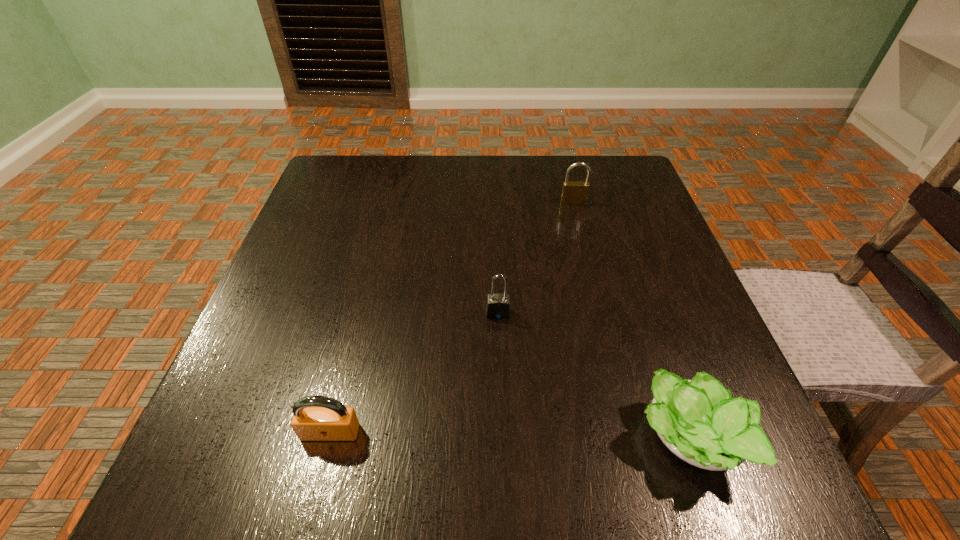
Locate an element on the screen. vacant space at the near edge is located at coordinates (545, 467).

The height and width of the screenshot is (540, 960). I want to click on blank space at the left edge, so click(359, 249).

What are the coordinates of `blank space at the right edge of the desktop` in the screenshot? It's located at (681, 308).

Where is `free point at the far left corner`? This screenshot has width=960, height=540. free point at the far left corner is located at coordinates (324, 170).

Locate an element on the screen. This screenshot has width=960, height=540. free space at the near left corner of the desktop is located at coordinates (196, 493).

This screenshot has height=540, width=960. I want to click on free region at the far right corner of the desktop, so click(x=612, y=172).

At what (x,y) coordinates should I click in order to perform the action: click on free space between the second object from left to right and the leftmost object. Please return your answer as a coordinate pair (x, y). The image size is (960, 540). Looking at the image, I should click on (414, 373).

Find the location of a particular element. The width and height of the screenshot is (960, 540). free space between the shortest object and the second nearest padlock is located at coordinates (593, 376).

In order to click on free point between the second farthest object and the lettuce in this screenshot , I will do `click(593, 376)`.

This screenshot has width=960, height=540. I want to click on free space that is in between the nearest padlock and the shortest object, so click(x=510, y=436).